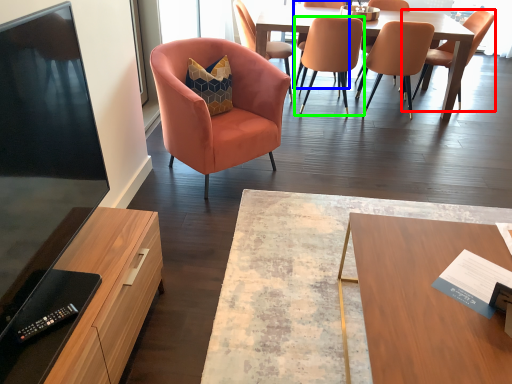
Question: Considering the real-world distances, which object is closest to chair (highlighted by a red box)? chair (highlighted by a blue box) or chair (highlighted by a green box).

Choices:
 (A) chair
 (B) chair

Answer: (B)